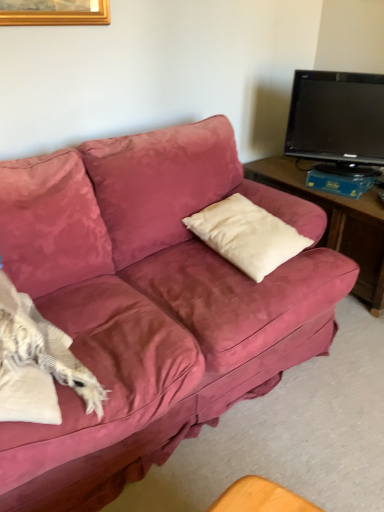
Question: Is black glossy tv at upper right positioned behind white soft cushion at center?

Choices:
 (A) yes
 (B) no

Answer: (A)

Question: Considering the relative sizes of black glossy tv at upper right and white soft cushion at center in the image provided, is black glossy tv at upper right shorter than white soft cushion at center?

Choices:
 (A) yes
 (B) no

Answer: (B)

Question: Considering the relative sizes of black glossy tv at upper right and white soft cushion at center in the image provided, is black glossy tv at upper right bigger than white soft cushion at center?

Choices:
 (A) no
 (B) yes

Answer: (B)

Question: Is black glossy tv at upper right facing away from white soft cushion at center?

Choices:
 (A) yes
 (B) no

Answer: (B)

Question: Is black glossy tv at upper right facing towards white soft cushion at center?

Choices:
 (A) yes
 (B) no

Answer: (A)

Question: Is black glossy tv at upper right taller than white soft cushion at center?

Choices:
 (A) yes
 (B) no

Answer: (A)

Question: Considering the relative sizes of white soft cushion at center and black glossy tv at upper right in the image provided, is white soft cushion at center thinner than black glossy tv at upper right?

Choices:
 (A) no
 (B) yes

Answer: (A)

Question: Is white soft cushion at center facing towards black glossy tv at upper right?

Choices:
 (A) no
 (B) yes

Answer: (A)

Question: From a real-world perspective, is white soft cushion at center positioned over black glossy tv at upper right based on gravity?

Choices:
 (A) no
 (B) yes

Answer: (A)

Question: Is white soft cushion at center to the right of black glossy tv at upper right from the viewer's perspective?

Choices:
 (A) no
 (B) yes

Answer: (A)

Question: Can you confirm if white soft cushion at center is bigger than black glossy tv at upper right?

Choices:
 (A) no
 (B) yes

Answer: (A)

Question: From a real-world perspective, is white soft cushion at center below black glossy tv at upper right?

Choices:
 (A) no
 (B) yes

Answer: (B)

Question: From the image's perspective, relative to white soft cushion at center, is black glossy tv at upper right above or below?

Choices:
 (A) above
 (B) below

Answer: (A)